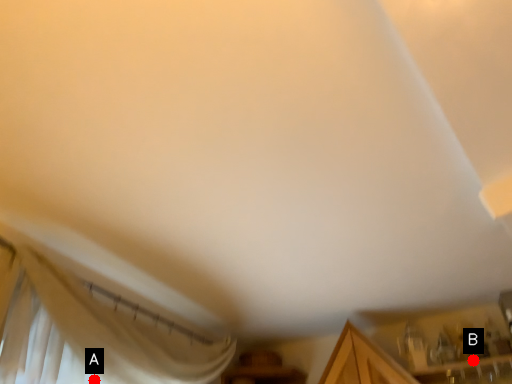
Question: Two points are circled on the image, labeled by A and B beside each circle. Which point appears closest to the camera in this image?

Choices:
 (A) A is closer
 (B) B is closer

Answer: (A)